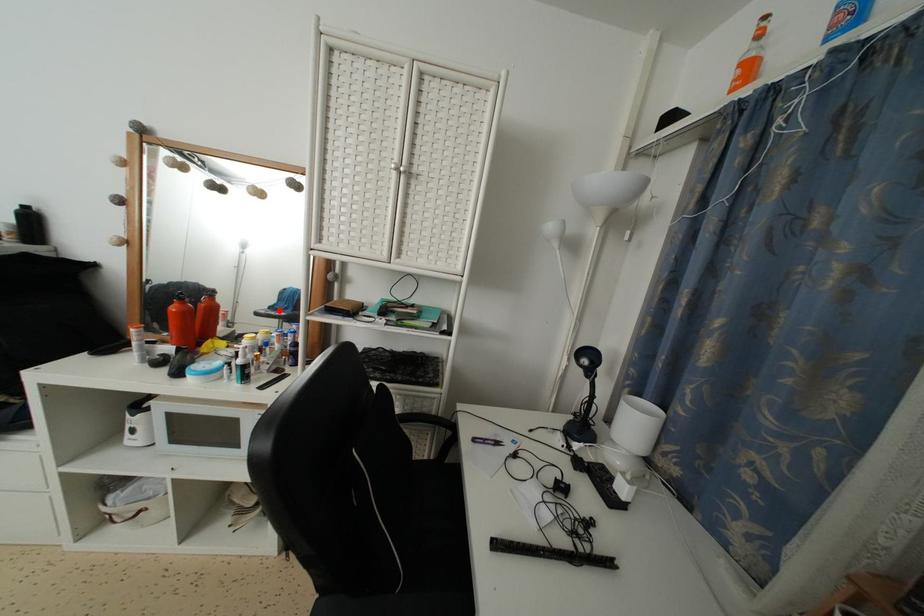
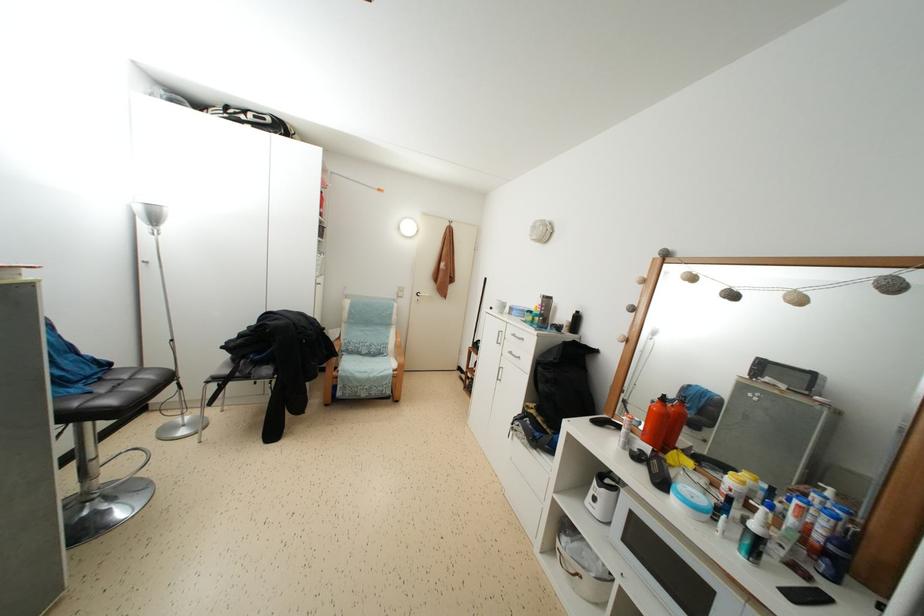
Question: I am providing you with two images of the same scene from different viewpoints. A red point is shown in image1. For the corresponding object point in image2, is it positioned nearer or farther from the camera?

Choices:
 (A) Nearer
 (B) Farther

Answer: (A)